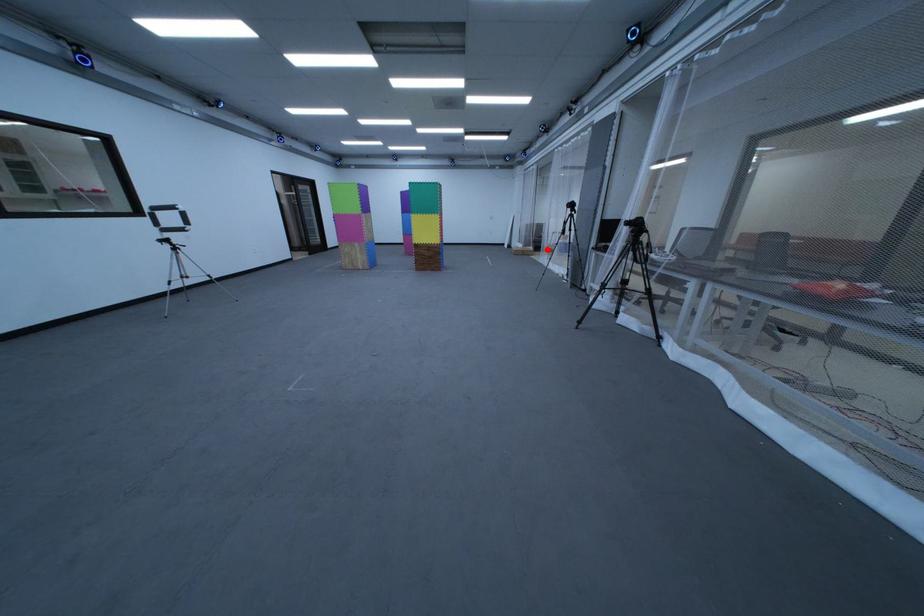
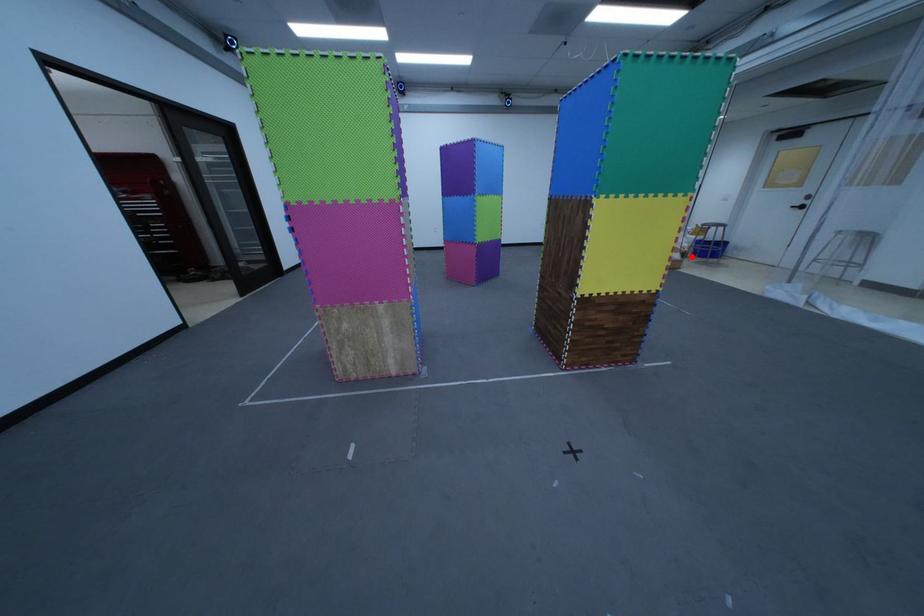
I am providing you with two images of the same scene from different viewpoints. A red point is marked on the first image and another point is marked on the second image. Are the points marked in image1 and image2 representing the same 3D position?

Yes